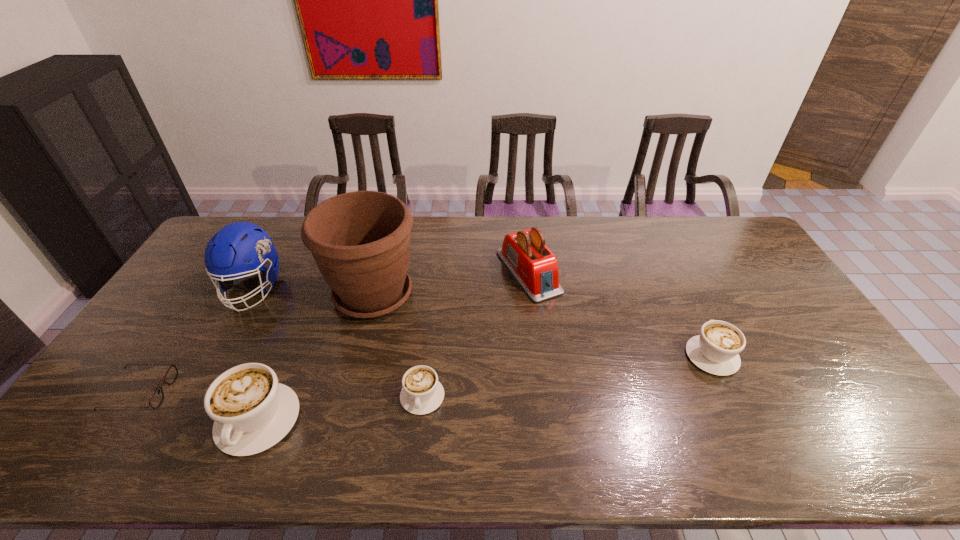
The height and width of the screenshot is (540, 960). Identify the location of the fourth shortest object. (252, 412).

The width and height of the screenshot is (960, 540). I want to click on the leftmost cappuccino, so click(x=252, y=412).

Where is `the shortest cappuccino`? the shortest cappuccino is located at coordinates (422, 393).

At what (x,y) coordinates should I click in order to perform the action: click on the second shortest object. Please return your answer as a coordinate pair (x, y). The image size is (960, 540). Looking at the image, I should click on (422, 393).

You are a GUI agent. You are given a task and a screenshot of the screen. Output one action in this format:
    pyautogui.click(x=<x>, y=<y>)
    Task: Click on the farthest cappuccino
    
    Given the screenshot: What is the action you would take?
    pyautogui.click(x=716, y=350)

At what (x,y) coordinates should I click in order to perform the action: click on the second tallest cappuccino. Please return your answer as a coordinate pair (x, y). Looking at the image, I should click on (716, 350).

Identify the location of the second object from right to left. (534, 266).

Locate an element on the screen. This screenshot has width=960, height=540. the fifth shortest object is located at coordinates (534, 266).

Find the location of a particular element. The width and height of the screenshot is (960, 540). the second tallest object is located at coordinates (238, 242).

I want to click on flowerpot, so click(x=360, y=241).